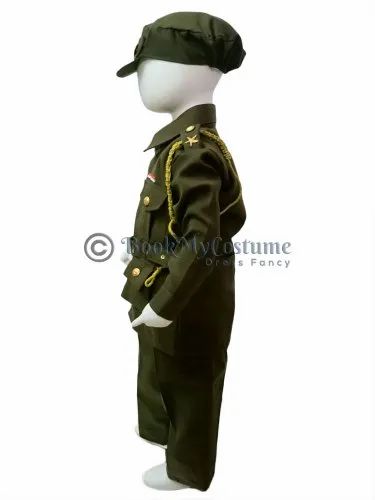
Find the location of a particular element. This screenshot has width=375, height=500. mannequin's left hand is located at coordinates coord(154,319).